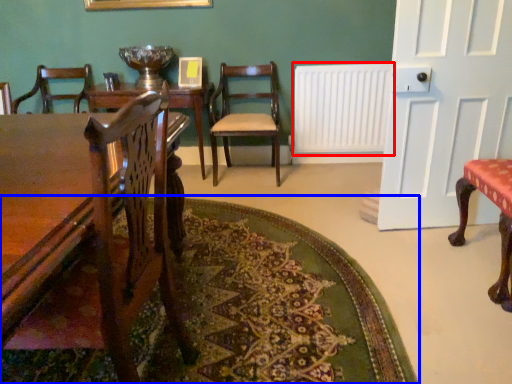
Question: Which object is further to the camera taking this photo, radiator (highlighted by a red box) or mat (highlighted by a blue box)?

Choices:
 (A) radiator
 (B) mat

Answer: (A)